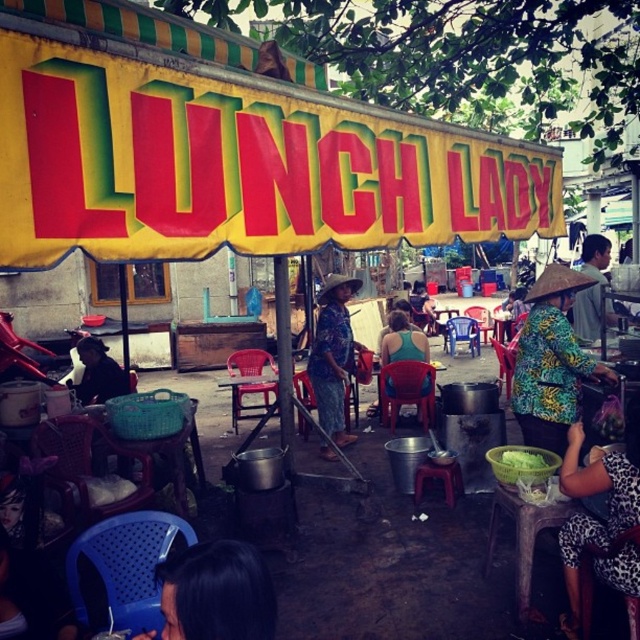
Describe the element at coordinates (552, 362) in the screenshot. I see `batik-patterned fabric at center` at that location.

Describe the element at coordinates (552, 362) in the screenshot. The height and width of the screenshot is (640, 640). I see `batik-patterned fabric at center` at that location.

Image resolution: width=640 pixels, height=640 pixels. I want to click on batik-patterned fabric at center, so click(x=552, y=362).

From the picture: Can you confirm if printed fabric skirt at center is positioned to the right of green fabric shirt at center?

No, printed fabric skirt at center is not to the right of green fabric shirt at center.

Can you confirm if printed fabric skirt at center is smaller than green fabric shirt at center?

No.

The width and height of the screenshot is (640, 640). I want to click on printed fabric skirt at center, so click(332, 355).

Where is `printed fabric skirt at center`? The height and width of the screenshot is (640, 640). printed fabric skirt at center is located at coordinates (332, 355).

Locate an element on the screen. The height and width of the screenshot is (640, 640). printed fabric skirt at center is located at coordinates click(x=332, y=355).

What are the coordinates of `printed fabric skirt at center` in the screenshot? It's located at (332, 355).

Identify the location of printed fabric skirt at center. Image resolution: width=640 pixels, height=640 pixels. [332, 355].